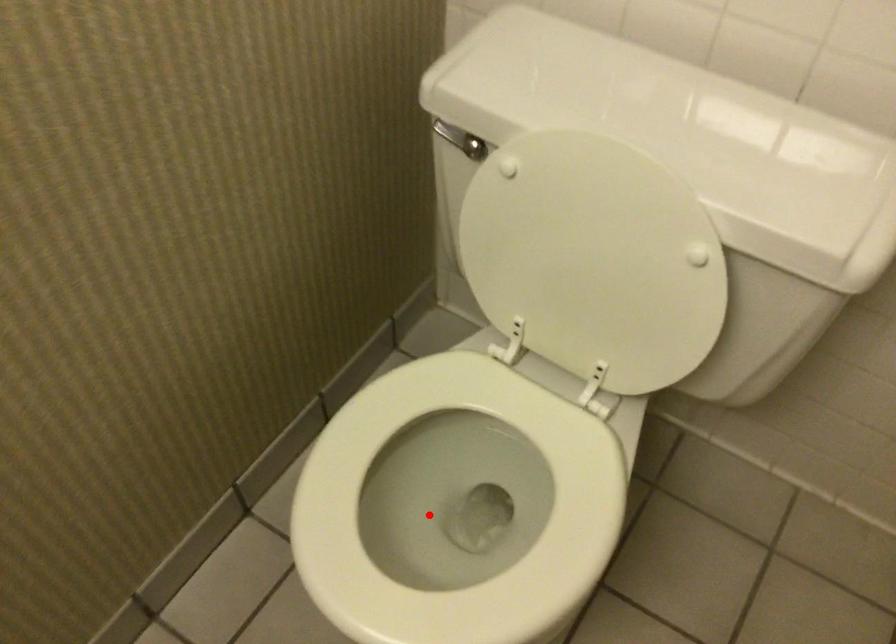
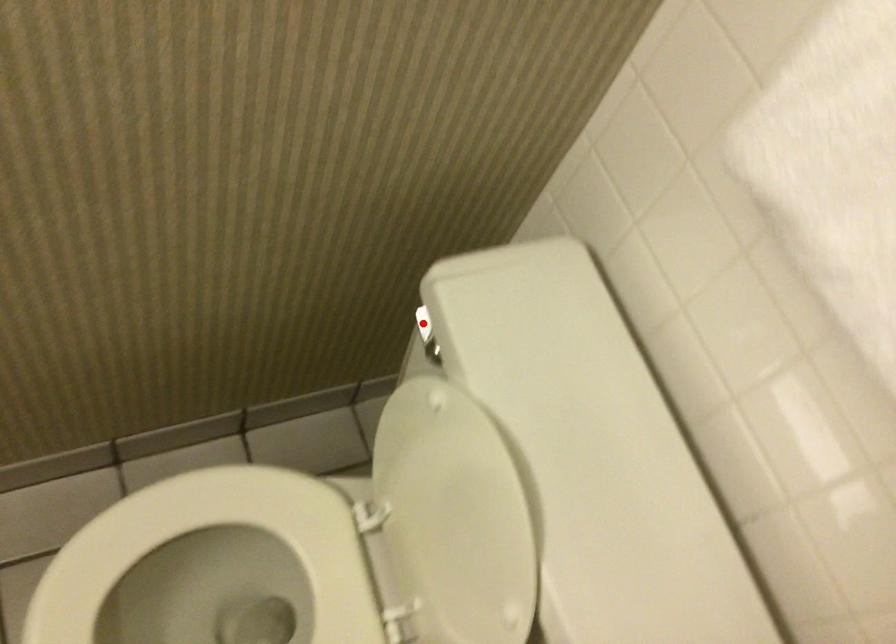
I am providing you with two images of the same scene from different viewpoints. A red point is marked on the first image and another point is marked on the second image. Does the point marked in image1 correspond to the same location as the one in image2?

No